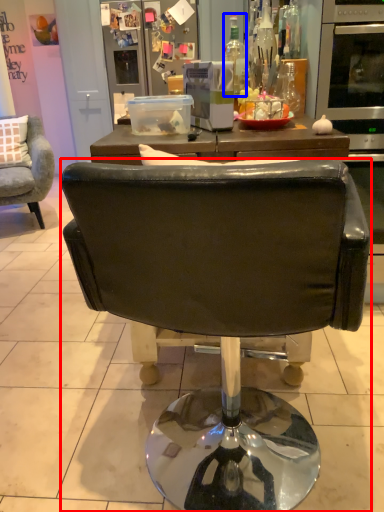
Question: Among these objects, which one is nearest to the camera, chair (highlighted by a red box) or bottle (highlighted by a blue box)?

Choices:
 (A) chair
 (B) bottle

Answer: (A)